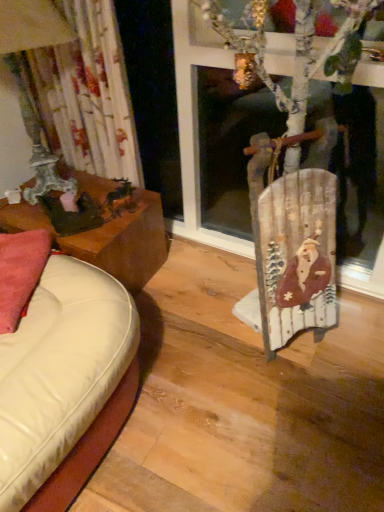
Identify the location of free spot to the right of wooden sled at right. (354, 345).